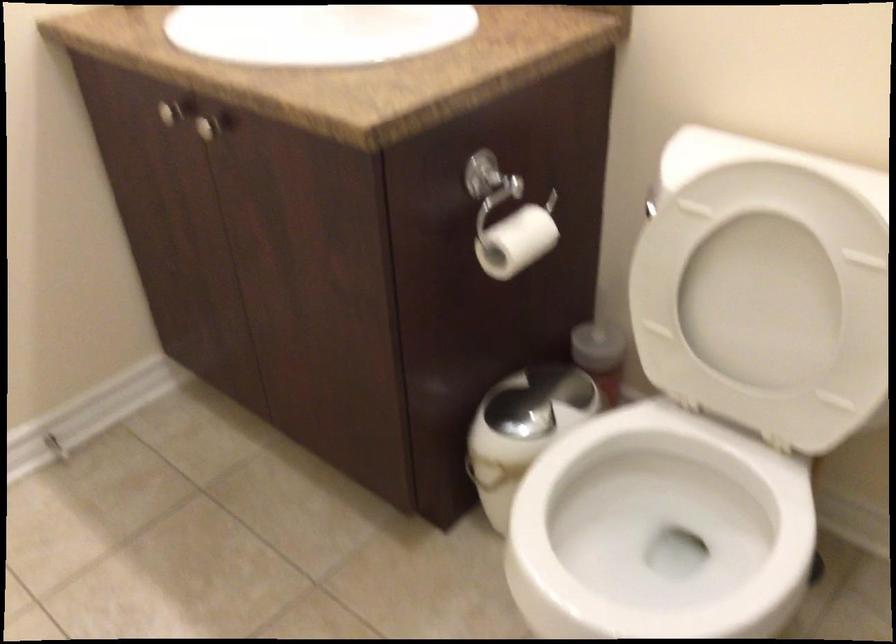
Where is `metal trash can lid`? metal trash can lid is located at coordinates (529, 413).